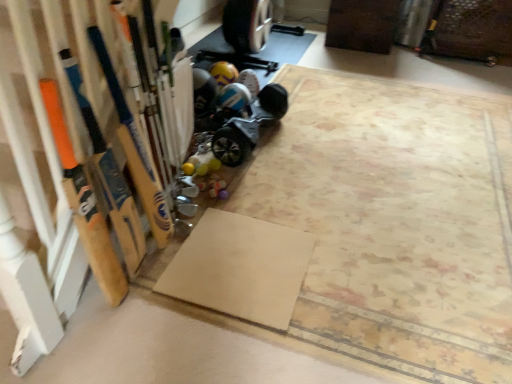
At what (x,y) coordinates should I click in order to perform the action: click on vacant area located to the right-hand side of beige matte yoga mat at lower center. Please return your answer as a coordinate pair (x, y). Looking at the image, I should click on (354, 273).